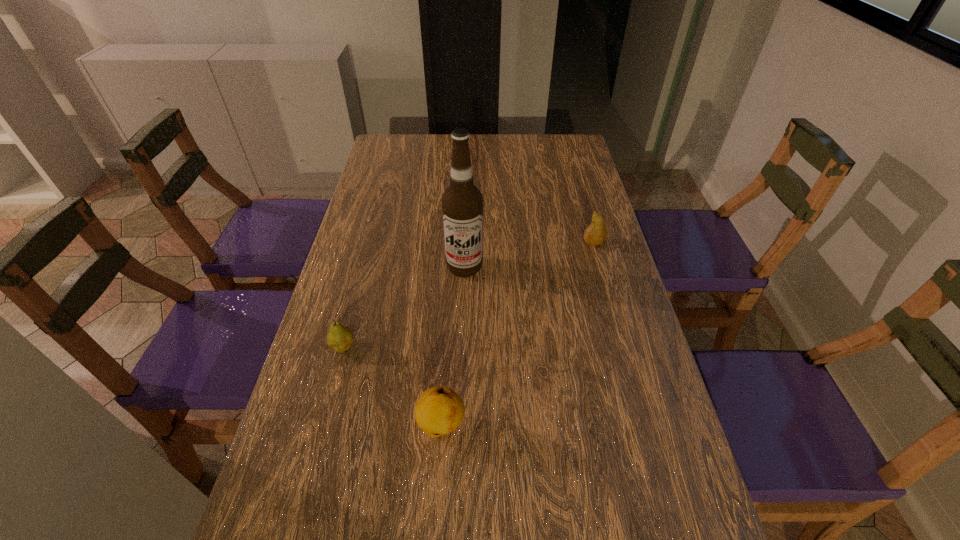
Locate an element on the screen. The height and width of the screenshot is (540, 960). free space between the farthest object and the second nearest object is located at coordinates pos(468,295).

Identify the location of vacant area that lies between the leftmost object and the alcohol. (404, 307).

Identify the location of empty location between the nearest pear and the farthest object. (517, 334).

Where is `vacant space that is in between the shortest pear and the farthest object`? The width and height of the screenshot is (960, 540). vacant space that is in between the shortest pear and the farthest object is located at coordinates (468, 295).

What are the coordinates of `vacant area that lies between the shortest object and the farthest pear` in the screenshot? It's located at (468, 295).

The height and width of the screenshot is (540, 960). I want to click on free spot between the rightmost object and the tallest object, so click(x=529, y=255).

Where is `vacant area between the shortest pear and the alcohol`? The image size is (960, 540). vacant area between the shortest pear and the alcohol is located at coordinates (404, 307).

This screenshot has width=960, height=540. What are the coordinates of `vacant point located between the tallest object and the shortest pear` in the screenshot? It's located at (404, 307).

Find the location of `empty location between the farthest pear and the second pear from right to left`. empty location between the farthest pear and the second pear from right to left is located at coordinates (517, 334).

Locate an element on the screen. Image resolution: width=960 pixels, height=540 pixels. object that stands as the third closest to the second pear from left to right is located at coordinates (596, 233).